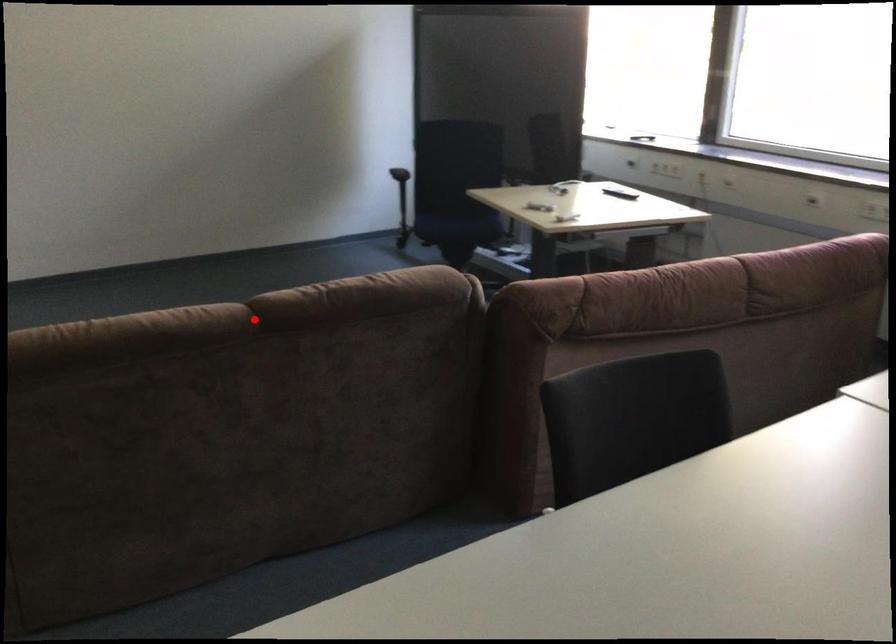
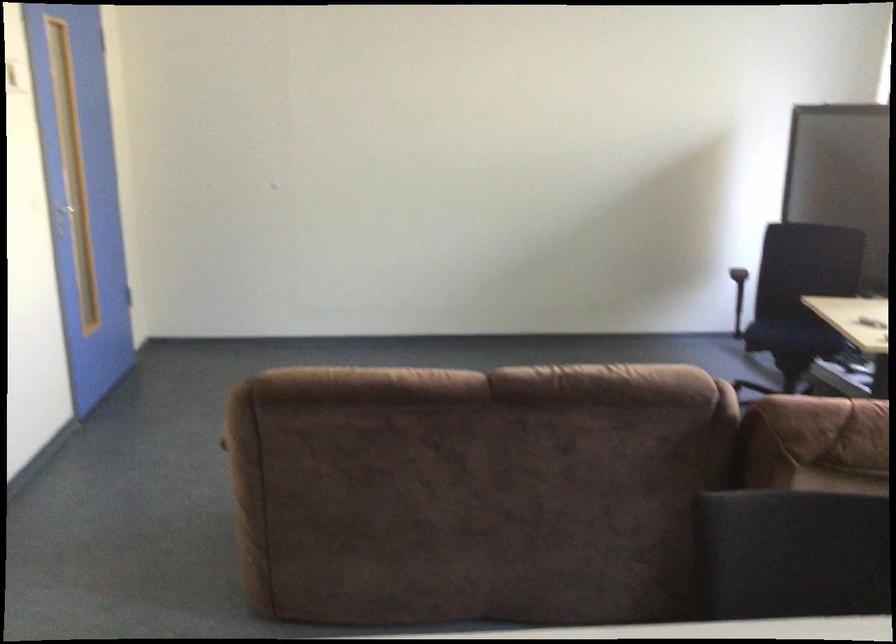
Question: I am providing you with two images of the same scene from different viewpoints. A red point is marked on the first image. At the location where the point appears in image 1, is it still visible in image 2?

Choices:
 (A) Yes
 (B) No

Answer: (A)